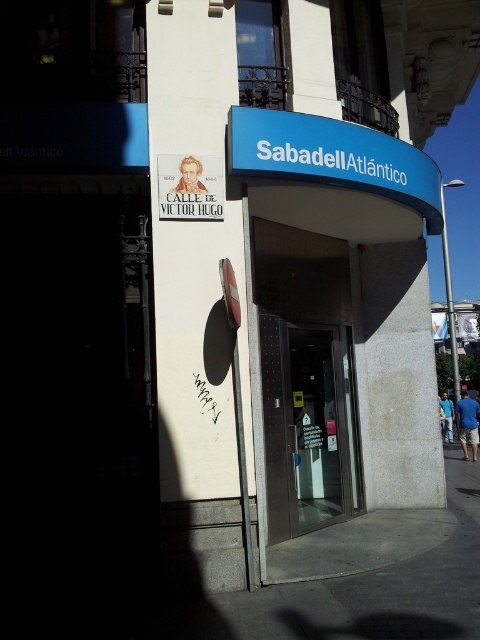
Question: Does gray concrete pavement at lower center appear on the left side of white paper sign at upper left?

Choices:
 (A) yes
 (B) no

Answer: (B)

Question: Which object appears closest to the camera in this image?

Choices:
 (A) blue plastic sign at upper center
 (B) gray concrete pavement at lower center
 (C) white paper sign at upper left
 (D) metallic glass door at center

Answer: (B)

Question: Which of the following is the farthest from the observer?

Choices:
 (A) gray concrete pavement at lower center
 (B) white paper sign at upper left

Answer: (B)

Question: Among these points, which one is farthest from the camera?

Choices:
 (A) (291, 472)
 (B) (466, 602)
 (C) (205, 161)
 (D) (334, 173)

Answer: (A)

Question: Is metallic glass door at center smaller than blue plastic sign at upper center?

Choices:
 (A) no
 (B) yes

Answer: (B)

Question: Can you confirm if gray concrete pavement at lower center is positioned to the right of metallic glass door at center?

Choices:
 (A) yes
 (B) no

Answer: (A)